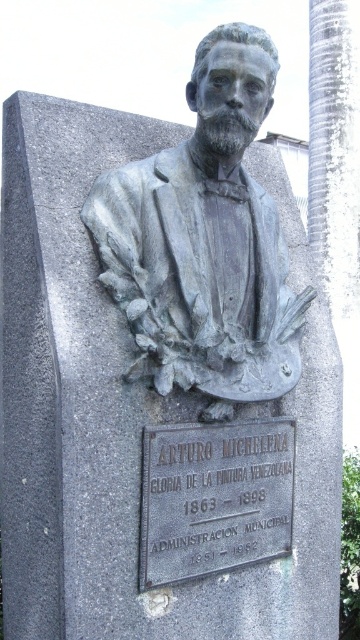
You are an art student visiting this memorial. You want to take a photo of the bronze bust at center and the black metal plaque at center. Which object should you focus on first if you want to capture both in one frame without moving the camera?

You should focus on the bronze bust at center first because it is located above the black metal plaque at center, so adjusting focus to the upper object ensures both are in the frame.

What are the coordinates of the bronze bust at center?

The bronze bust at center is located at point (204, 241).

What is located at the point with coordinates (204, 241)?

The bronze bust at center is located at point (204, 241).